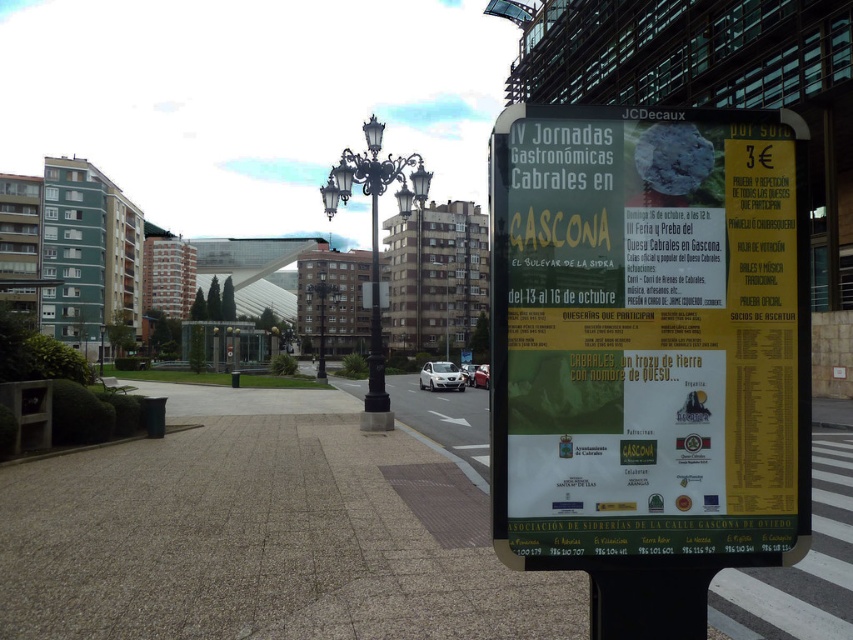
You are a city planner analyzing the urban space in the image. The white paper poster at right and the gray concrete pavement at center are both visible. Which object takes up more area in the scene?

The gray concrete pavement at center occupies more area than the white paper poster at right.

You are standing in front of the urban scene described. You want to take a photo of the white paper poster at right with your phone, which has a minimum focus distance of 1 meter. Can you focus on the poster without moving closer?

The white paper poster at right is 2.53 meters away from camera, so yes, you can focus on it since your phone can focus at that distance, which is beyond the minimum focus distance of 1 meter.

You are a tourist in the area and want to take a photo of the gray concrete pavement at center while also including the white paper poster at right in the frame. Based on their positions, can you position yourself in a way that both objects are visible in the photo?

The white paper poster at right is to the right of the gray concrete pavement at center, so positioning yourself to the left of the gray concrete pavement at center should allow both objects to be visible in the photo.